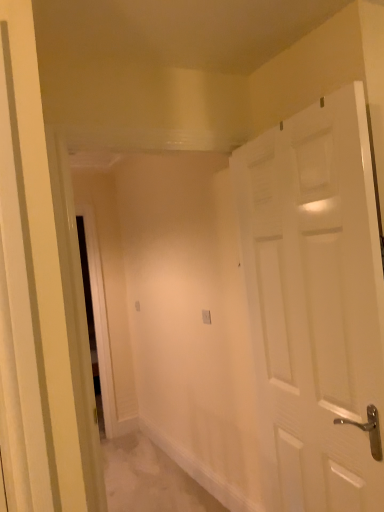
Question: From a real-world perspective, is white matte door at right over white plastic electric outlet at center?

Choices:
 (A) yes
 (B) no

Answer: (A)

Question: Would you consider white matte door at right to be distant from white plastic electric outlet at center?

Choices:
 (A) no
 (B) yes

Answer: (B)

Question: Is white matte door at right to the left of white plastic electric outlet at center from the viewer's perspective?

Choices:
 (A) no
 (B) yes

Answer: (A)

Question: Is white matte door at right surrounding white plastic electric outlet at center?

Choices:
 (A) no
 (B) yes

Answer: (A)

Question: Considering the relative sizes of white matte door at right and white plastic electric outlet at center in the image provided, is white matte door at right thinner than white plastic electric outlet at center?

Choices:
 (A) yes
 (B) no

Answer: (B)

Question: Does white matte door at right come behind white plastic electric outlet at center?

Choices:
 (A) yes
 (B) no

Answer: (B)

Question: Considering the relative positions of white plastic electric outlet at center and white matte door at right in the image provided, is white plastic electric outlet at center to the left of white matte door at right from the viewer's perspective?

Choices:
 (A) no
 (B) yes

Answer: (B)

Question: Is white plastic electric outlet at center closer to camera compared to white matte door at right?

Choices:
 (A) yes
 (B) no

Answer: (B)

Question: Does white plastic electric outlet at center have a greater width compared to white matte door at right?

Choices:
 (A) no
 (B) yes

Answer: (A)

Question: Is white plastic electric outlet at center not close to white matte door at right?

Choices:
 (A) yes
 (B) no

Answer: (A)

Question: From a real-world perspective, is white plastic electric outlet at center beneath white matte door at right?

Choices:
 (A) no
 (B) yes

Answer: (B)

Question: Can you confirm if white plastic electric outlet at center is bigger than white matte door at right?

Choices:
 (A) yes
 (B) no

Answer: (B)

Question: Is white plastic electric outlet at center in front of or behind white matte door at right in the image?

Choices:
 (A) behind
 (B) front

Answer: (A)